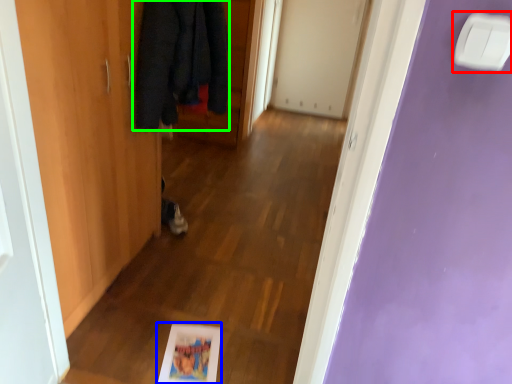
Question: Which object is positioned closest to light switch (highlighted by a red box)? Select from picture frame (highlighted by a blue box) and cloak (highlighted by a green box).

Choices:
 (A) picture frame
 (B) cloak

Answer: (B)